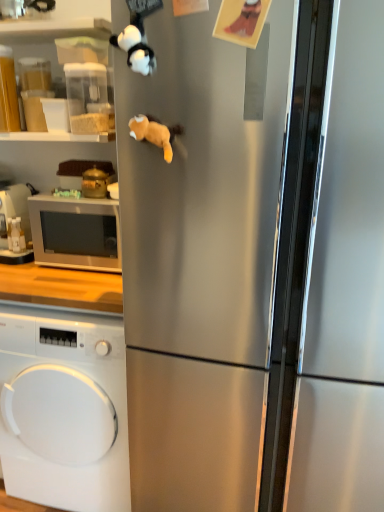
Describe the element at coordinates (135, 47) in the screenshot. The width and height of the screenshot is (384, 512). I see `white plush panda at upper left, arranged as the 2th animal when ordered from the bottom` at that location.

What do you see at coordinates (64, 410) in the screenshot? This screenshot has width=384, height=512. I see `white matte washing machine at lower left` at bounding box center [64, 410].

What is the approximate height of gold metallic pot at left, the 2th appliance in the back-to-front sequence?

It is 5.16 inches.

Where is `matte black microwave at left, the 1th appliance viewed from the left`? The width and height of the screenshot is (384, 512). matte black microwave at left, the 1th appliance viewed from the left is located at coordinates (14, 224).

This screenshot has height=512, width=384. Find the location of `satin silver refrigerator at center`. satin silver refrigerator at center is located at coordinates (256, 264).

From the image's perspective, who appears lower, white glossy microwave at left or white plush panda at upper left, arranged as the 2th animal when ordered from the bottom?

white glossy microwave at left, from the image's perspective.

This screenshot has width=384, height=512. In order to click on microwave oven behind the white plush panda at upper left, the first animal in the top-to-bottom sequence in this screenshot , I will do 76,233.

Does white glossy microwave at left have a smaller size compared to white plush panda at upper left, the first animal in the top-to-bottom sequence?

Incorrect, white glossy microwave at left is not smaller in size than white plush panda at upper left, the first animal in the top-to-bottom sequence.

How much distance is there between white glossy microwave at left and white plush panda at upper left, arranged as the 2th animal when ordered from the bottom?

They are 74.28 centimeters apart.

From the image's perspective, which one is positioned higher, gold metallic pot at left, the 2th appliance in the back-to-front sequence, or matte black microwave at left, placed as the second appliance when sorted from front to back?

gold metallic pot at left, the 2th appliance in the back-to-front sequence, appears higher in the image.

Can you confirm if gold metallic pot at left, the 2th appliance positioned from the left, is positioned to the right of matte black microwave at left, placed as the second appliance when sorted from right to left?

Correct, you'll find gold metallic pot at left, the 2th appliance positioned from the left, to the right of matte black microwave at left, placed as the second appliance when sorted from right to left.

How far apart are gold metallic pot at left, the 2th appliance positioned from the left, and matte black microwave at left, placed as the second appliance when sorted from right to left?

gold metallic pot at left, the 2th appliance positioned from the left, is 13.58 inches away from matte black microwave at left, placed as the second appliance when sorted from right to left.

Considering the relative sizes of gold metallic pot at left, the 1th appliance from the front, and matte black microwave at left, the 1th appliance viewed from the left, in the image provided, is gold metallic pot at left, the 1th appliance from the front, taller than matte black microwave at left, the 1th appliance viewed from the left,?

No, gold metallic pot at left, the 1th appliance from the front, is not taller than matte black microwave at left, the 1th appliance viewed from the left.

From the satin silver refrigerator at center, count the 1st appliance to the left and point to it. Please provide its 2D coordinates.

[(94, 183)]

Does gold metallic pot at left, the 2th appliance in the back-to-front sequence, turn towards satin silver refrigerator at center?

No, gold metallic pot at left, the 2th appliance in the back-to-front sequence, does not turn towards satin silver refrigerator at center.

Which of these two, gold metallic pot at left, the 1th appliance from the front, or satin silver refrigerator at center, is bigger?

With larger size is satin silver refrigerator at center.

From the image's perspective, is gold metallic pot at left, the 1th appliance from the front, located beneath satin silver refrigerator at center?

Incorrect, from the image's perspective, gold metallic pot at left, the 1th appliance from the front, is higher than satin silver refrigerator at center.

Is white matte washing machine at lower left closer to camera compared to white glossy microwave at left?

Yes, it is in front of white glossy microwave at left.

From the image's perspective, relative to white glossy microwave at left, is white matte washing machine at lower left above or below?

white matte washing machine at lower left is situated lower than white glossy microwave at left in the image.

How much distance is there between white matte washing machine at lower left and white glossy microwave at left?

white matte washing machine at lower left and white glossy microwave at left are 18.25 inches apart.

In the image, is white matte washing machine at lower left on the left side or the right side of white glossy microwave at left?

Based on their positions, white matte washing machine at lower left is located to the left of white glossy microwave at left.

Is white plush panda at upper left, arranged as the 2th animal when ordered from the bottom, shorter than matte black microwave at left, placed as the second appliance when sorted from right to left?

Yes.

Would you say white plush panda at upper left, the first animal in the top-to-bottom sequence, is inside or outside matte black microwave at left, arranged as the 1th appliance when viewed from the back?

The correct answer is: outside.

From the image's perspective, is white plush panda at upper left, arranged as the 2th animal when ordered from the bottom, located above or below matte black microwave at left, placed as the second appliance when sorted from front to back?

white plush panda at upper left, arranged as the 2th animal when ordered from the bottom, is above matte black microwave at left, placed as the second appliance when sorted from front to back.

In the image, is white plush panda at upper left, the first animal in the top-to-bottom sequence, on the left side or the right side of matte black microwave at left, the 1th appliance viewed from the left?

white plush panda at upper left, the first animal in the top-to-bottom sequence, is to the right of matte black microwave at left, the 1th appliance viewed from the left.

Would you say gold metallic pot at left, the 2th appliance in the back-to-front sequence, is part of white glossy microwave at left's contents?

No, gold metallic pot at left, the 2th appliance in the back-to-front sequence, is located outside of white glossy microwave at left.

Is point (86, 226) more distant than point (97, 188)?

No, (86, 226) is closer to viewer.

From the image's perspective, which object appears higher, white glossy microwave at left or gold metallic pot at left, the 2th appliance in the back-to-front sequence?

gold metallic pot at left, the 2th appliance in the back-to-front sequence, is shown above in the image.

This screenshot has height=512, width=384. What are the coordinates of `microwave oven below the gold metallic pot at left, the 1th appliance in the right-to-left sequence (from a real-world perspective)` in the screenshot? It's located at (76, 233).

From a real-world perspective, is gold metallic pot at left, the 2th appliance in the back-to-front sequence, under orange plush toy at upper center, which is the 1th animal from bottom to top?

Correct, in the physical world, gold metallic pot at left, the 2th appliance in the back-to-front sequence, is lower than orange plush toy at upper center, which is the 1th animal from bottom to top.

Is gold metallic pot at left, the 2th appliance in the back-to-front sequence, next to orange plush toy at upper center, the 2th animal from the top, and touching it?

No, gold metallic pot at left, the 2th appliance in the back-to-front sequence, is not beside orange plush toy at upper center, the 2th animal from the top.

Which is more to the left, gold metallic pot at left, the 2th appliance positioned from the left, or orange plush toy at upper center, the 2th animal from the top?

Positioned to the left is gold metallic pot at left, the 2th appliance positioned from the left.

Is gold metallic pot at left, the 1th appliance from the front, bigger or smaller than orange plush toy at upper center, which is the 1th animal from bottom to top?

Considering their sizes, gold metallic pot at left, the 1th appliance from the front, takes up less space than orange plush toy at upper center, which is the 1th animal from bottom to top.

Where is `microwave oven lying below the white plush panda at upper left, the first animal in the top-to-bottom sequence (from the image's perspective)`? The image size is (384, 512). microwave oven lying below the white plush panda at upper left, the first animal in the top-to-bottom sequence (from the image's perspective) is located at coordinates (76, 233).

Find the location of `appliance on the left of gold metallic pot at left, the 2th appliance positioned from the left`. appliance on the left of gold metallic pot at left, the 2th appliance positioned from the left is located at coordinates (14, 224).

Based on their spatial positions, is white matte washing machine at lower left or gold metallic pot at left, the 1th appliance in the right-to-left sequence, further from white plush panda at upper left, arranged as the 2th animal when ordered from the bottom?

white matte washing machine at lower left is positioned further to the anchor white plush panda at upper left, arranged as the 2th animal when ordered from the bottom.

Considering their positions, is orange plush toy at upper center, which is the 1th animal from bottom to top, positioned further to matte black microwave at left, placed as the second appliance when sorted from right to left, than white plush panda at upper left, the first animal in the top-to-bottom sequence?

Based on the image, white plush panda at upper left, the first animal in the top-to-bottom sequence, appears to be further to matte black microwave at left, placed as the second appliance when sorted from right to left.

When comparing their distances from white matte washing machine at lower left, does matte black microwave at left, placed as the second appliance when sorted from front to back, or white glossy microwave at left seem further?

The object further to white matte washing machine at lower left is matte black microwave at left, placed as the second appliance when sorted from front to back.

Based on the photo, looking at the image, which one is located further to white matte washing machine at lower left, orange plush toy at upper center, the 2th animal from the top, or satin silver refrigerator at center?

Among the two, orange plush toy at upper center, the 2th animal from the top, is located further to white matte washing machine at lower left.

Estimate the real-world distances between objects in this image. Which object is closer to white matte washing machine at lower left, satin silver refrigerator at center or matte black microwave at left, the 1th appliance viewed from the left?

Based on the image, satin silver refrigerator at center appears to be nearer to white matte washing machine at lower left.

From the image, which object appears to be farther from satin silver refrigerator at center, orange plush toy at upper center, which is the 1th animal from bottom to top, or gold metallic pot at left, the 2th appliance positioned from the left?

Based on the image, gold metallic pot at left, the 2th appliance positioned from the left, appears to be further to satin silver refrigerator at center.

Considering their positions, is gold metallic pot at left, the 1th appliance in the right-to-left sequence, positioned closer to satin silver refrigerator at center than white matte washing machine at lower left?

white matte washing machine at lower left is closer to satin silver refrigerator at center.

Looking at the image, which one is located further to satin silver refrigerator at center, orange plush toy at upper center, the 2th animal from the top, or white plush panda at upper left, the first animal in the top-to-bottom sequence?

white plush panda at upper left, the first animal in the top-to-bottom sequence.

Locate an element on the screen. animal that lies between white plush panda at upper left, arranged as the 2th animal when ordered from the bottom, and satin silver refrigerator at center from top to bottom is located at coordinates [x=155, y=133].

At what (x,y) coordinates should I click in order to perform the action: click on microwave oven between white plush panda at upper left, arranged as the 2th animal when ordered from the bottom, and gold metallic pot at left, the 2th appliance positioned from the left, from front to back. Please return your answer as a coordinate pair (x, y). Looking at the image, I should click on (76, 233).

What are the coordinates of `appliance between orange plush toy at upper center, the 2th animal from the top, and matte black microwave at left, the 1th appliance viewed from the left, in the front-back direction` in the screenshot? It's located at (94, 183).

Image resolution: width=384 pixels, height=512 pixels. What are the coordinates of `microwave oven positioned between orange plush toy at upper center, the 2th animal from the top, and matte black microwave at left, placed as the second appliance when sorted from front to back, from near to far` in the screenshot? It's located at pyautogui.click(x=76, y=233).